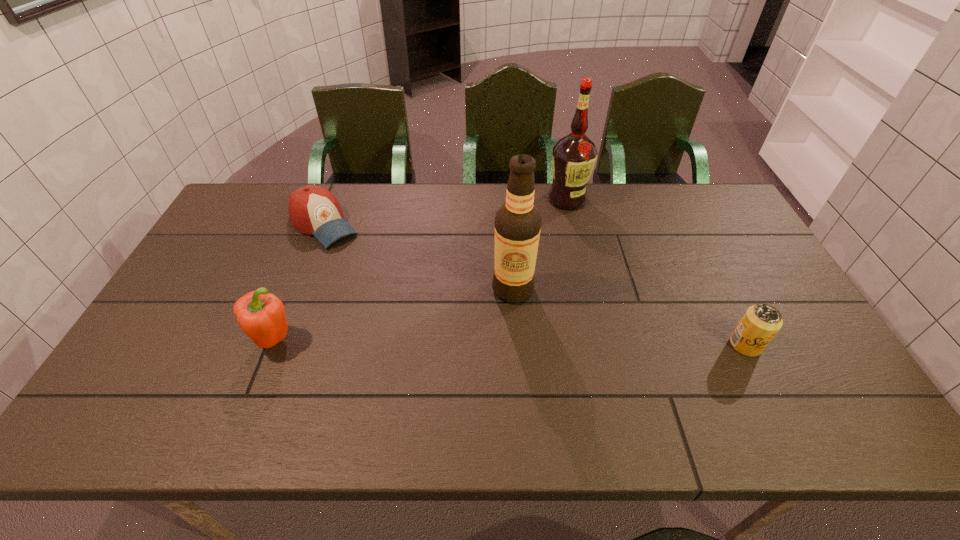
Where is `vacant space situated on the label of the third farthest object`? This screenshot has width=960, height=540. vacant space situated on the label of the third farthest object is located at coordinates (445, 375).

The width and height of the screenshot is (960, 540). I want to click on free space located 0.050m on the label of the third farthest object, so click(492, 315).

This screenshot has height=540, width=960. Identify the location of vacant position located 0.280m on the front-facing side of the baseball cap. (393, 293).

What are the coordinates of `free space located 0.130m on the front-facing side of the baseball cap` in the screenshot? It's located at (365, 265).

At what (x,y) coordinates should I click in order to perform the action: click on vacant space located 0.170m on the front-facing side of the baseball cap. Please return your answer as a coordinate pair (x, y). Looking at the image, I should click on (372, 272).

You are a GUI agent. You are given a task and a screenshot of the screen. Output one action in this format:
    pyautogui.click(x=<x>, y=<y>)
    Task: Click on the free location located on the label of the right alcohol
    
    Given the screenshot: What is the action you would take?
    pyautogui.click(x=553, y=279)

Identify the location of free location located on the label of the right alcohol. Image resolution: width=960 pixels, height=540 pixels. (557, 259).

The height and width of the screenshot is (540, 960). I want to click on vacant space located 0.220m on the label of the right alcohol, so click(x=557, y=254).

Where is `baseball cap that is at the far edge`? baseball cap that is at the far edge is located at coordinates (314, 210).

Identify the location of alcohol located in the far edge section of the desktop. (574, 156).